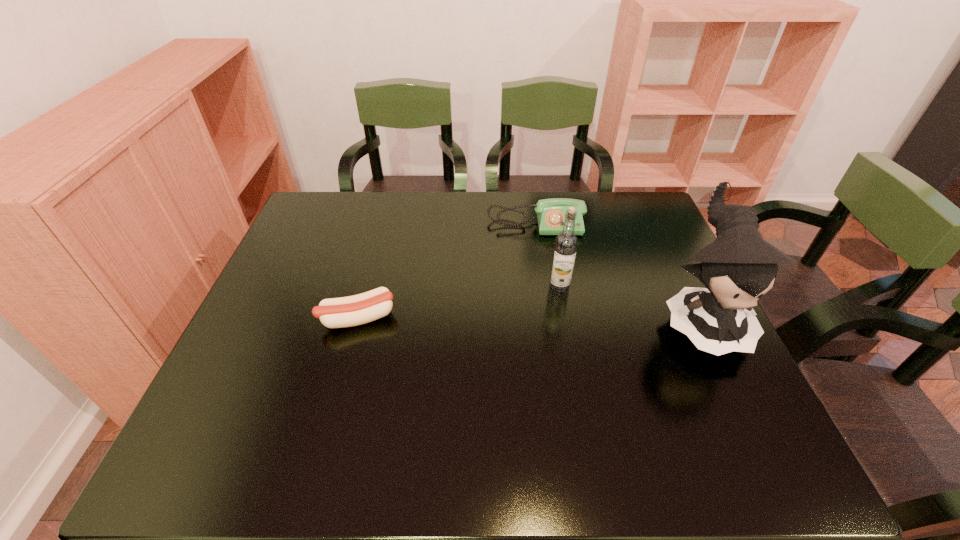
You are a GUI agent. You are given a task and a screenshot of the screen. Output one action in this format:
    pyautogui.click(x=<x>, y=<y>)
    Task: Click on the vacant space at the right edge
    The width and height of the screenshot is (960, 540).
    Given the screenshot: What is the action you would take?
    pyautogui.click(x=657, y=312)

In the image, there is a desktop. Identify the location of free space at the far left corner. (303, 229).

What are the coordinates of `free region at the far right corner of the desktop` in the screenshot? It's located at (625, 204).

This screenshot has width=960, height=540. I want to click on free space between the leftmost object and the doll, so click(x=529, y=319).

In order to click on vacant area between the tallest object and the leftmost object in this screenshot , I will do `click(529, 319)`.

Image resolution: width=960 pixels, height=540 pixels. In order to click on vacant area that lies between the vodka and the leftmost object in this screenshot , I will do `click(458, 303)`.

Locate an element on the screen. This screenshot has height=540, width=960. free spot between the farthest object and the third shortest object is located at coordinates (547, 256).

Locate an element on the screen. free space between the telephone and the rightmost object is located at coordinates (618, 272).

This screenshot has width=960, height=540. Identify the location of blank region between the sausage and the doll. (529, 319).

Where is `vacant area that lies between the telephone and the vodka`? vacant area that lies between the telephone and the vodka is located at coordinates (547, 256).